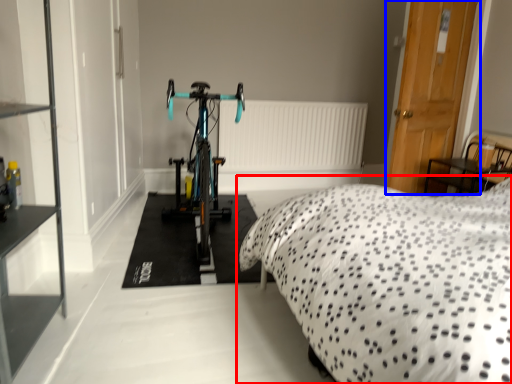
Question: Which object appears closest to the camera in this image, bed (highlighted by a red box) or door (highlighted by a blue box)?

Choices:
 (A) bed
 (B) door

Answer: (A)